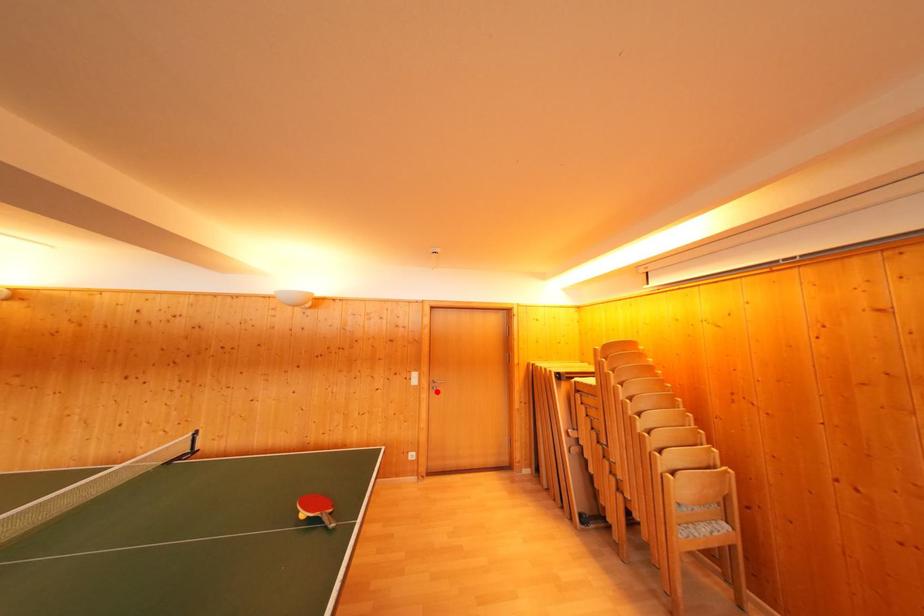
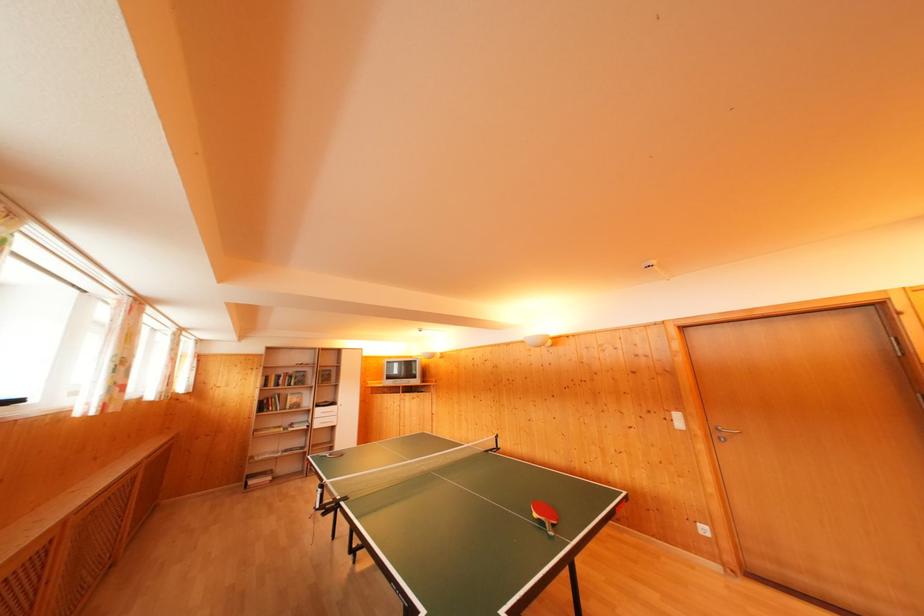
Where in the second image is the point corresponding to the highlighted location from the first image?

(718, 440)